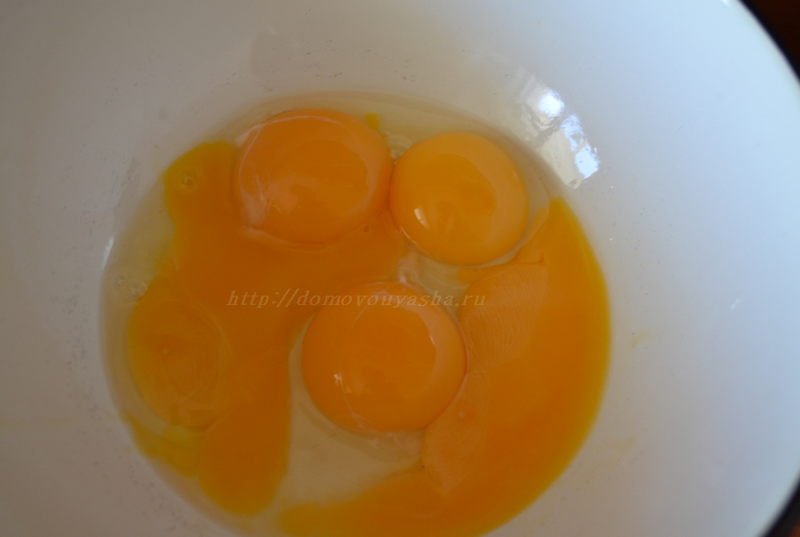
The width and height of the screenshot is (800, 537). In order to click on table in this screenshot , I will do `click(792, 20)`.